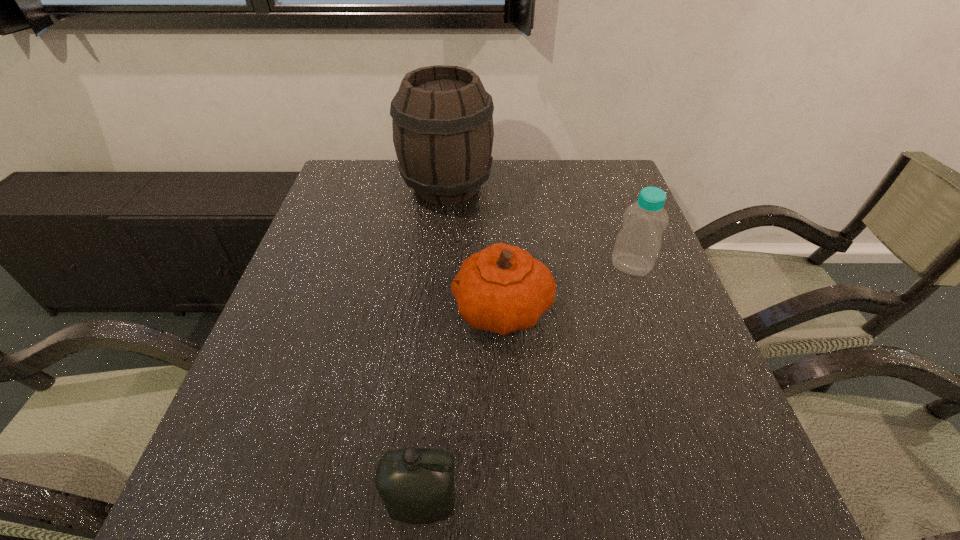
In the image, there is a desktop. At what (x,y) coordinates should I click in order to perform the action: click on vacant space at the far left corner. Please return your answer as a coordinate pair (x, y). Looking at the image, I should click on (339, 179).

At what (x,y) coordinates should I click in order to perform the action: click on vacant area between the pumpkin and the wine bucket. Please return your answer as a coordinate pair (x, y). The width and height of the screenshot is (960, 540). Looking at the image, I should click on (474, 248).

This screenshot has width=960, height=540. What are the coordinates of `vacant space that is in between the farther bottle and the tallest object` in the screenshot? It's located at (540, 226).

At what (x,y) coordinates should I click in order to perform the action: click on unoccupied position between the left bottle and the rightmost object. Please return your answer as a coordinate pair (x, y). The height and width of the screenshot is (540, 960). Looking at the image, I should click on (527, 385).

Where is `empty location between the pumpkin and the farthest object`? empty location between the pumpkin and the farthest object is located at coordinates (474, 248).

Locate an element on the screen. vacant space that's between the second tallest object and the pumpkin is located at coordinates point(566,287).

Where is `free space that is in between the nearer bottle and the right bottle`? The width and height of the screenshot is (960, 540). free space that is in between the nearer bottle and the right bottle is located at coordinates tap(527, 385).

Where is `vacant point located between the farthest object and the farther bottle`? This screenshot has height=540, width=960. vacant point located between the farthest object and the farther bottle is located at coordinates (540, 226).

You are a GUI agent. You are given a task and a screenshot of the screen. Output one action in this format:
    pyautogui.click(x=<x>, y=<y>)
    Task: Click on the vacant point located between the nearer bottle and the farther bottle
    This screenshot has height=540, width=960.
    Given the screenshot: What is the action you would take?
    pyautogui.click(x=527, y=385)

Where is `free space between the farthest object and the nearest object`? The image size is (960, 540). free space between the farthest object and the nearest object is located at coordinates (435, 346).